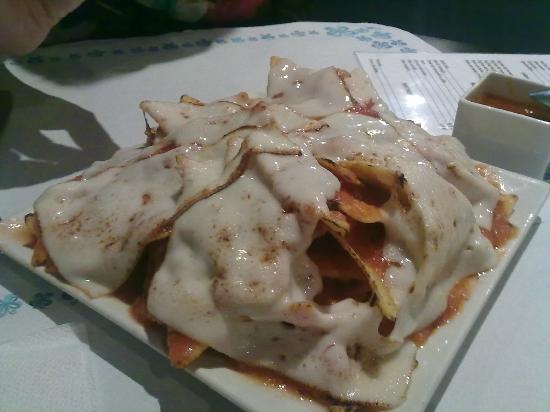
I want to click on pen, so click(542, 93).